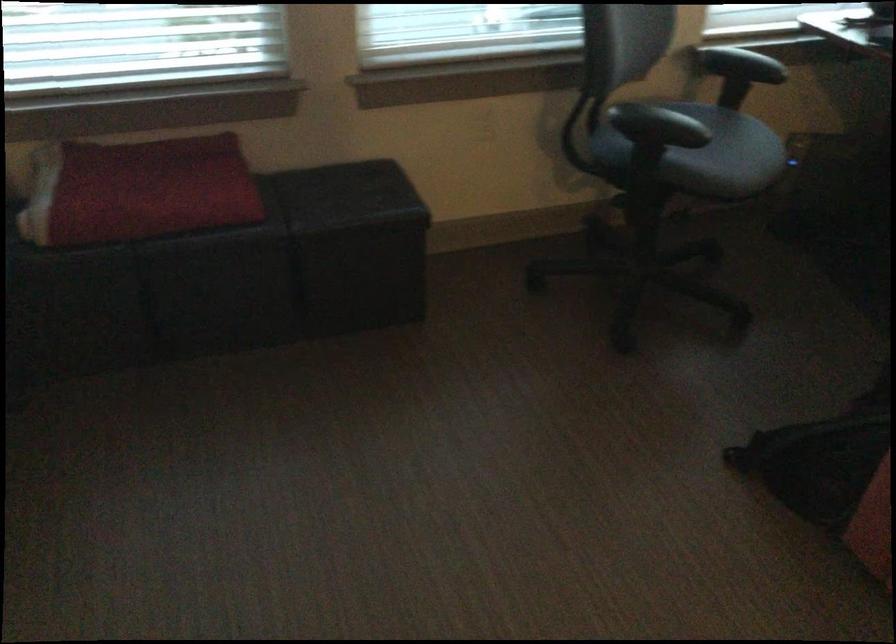
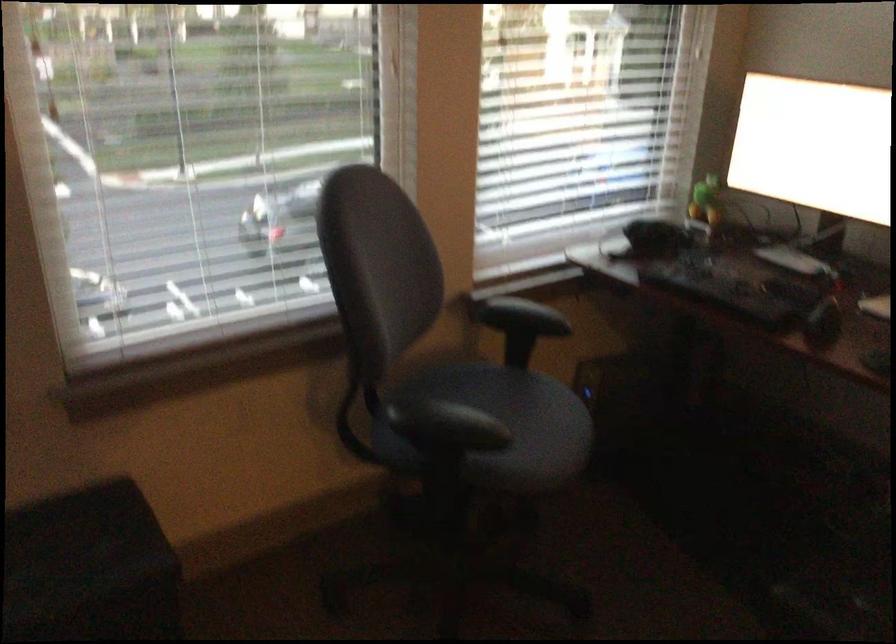
Where in the second image is the point corresponding to point (659, 108) from the first image?

(443, 424)